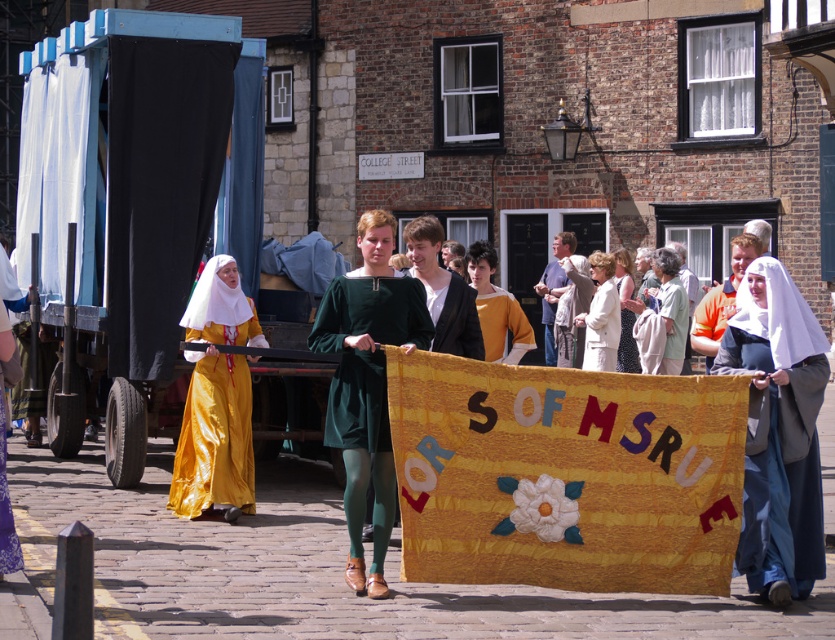
Question: Which point is closer to the camera?

Choices:
 (A) (633, 307)
 (B) (701, 317)
 (C) (586, 348)

Answer: (B)

Question: Does white fabric coat at center appear over orange cotton shirt at center?

Choices:
 (A) yes
 (B) no

Answer: (B)

Question: Which object is closer to the camera taking this photo?

Choices:
 (A) shiny gold dress at left
 (B) textured fabric banner at center

Answer: (B)

Question: From the image, what is the correct spatial relationship of orange cotton shirt at center in relation to white satin robe at center?

Choices:
 (A) below
 (B) above

Answer: (B)

Question: Which point is farther to the camera?

Choices:
 (A) (469, 296)
 (B) (582, 547)

Answer: (A)

Question: Does textured fabric banner at center appear under orange cotton shirt at center?

Choices:
 (A) yes
 (B) no

Answer: (A)